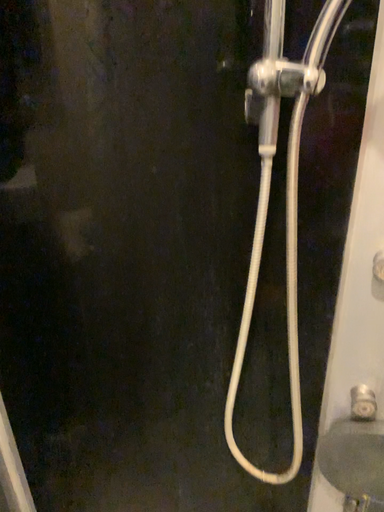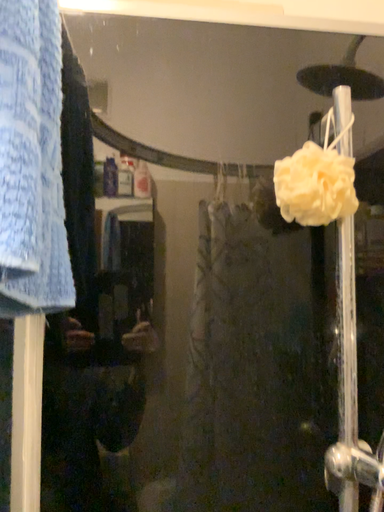
Question: How did the camera likely rotate when shooting the video?

Choices:
 (A) rotated downward
 (B) rotated upward

Answer: (B)